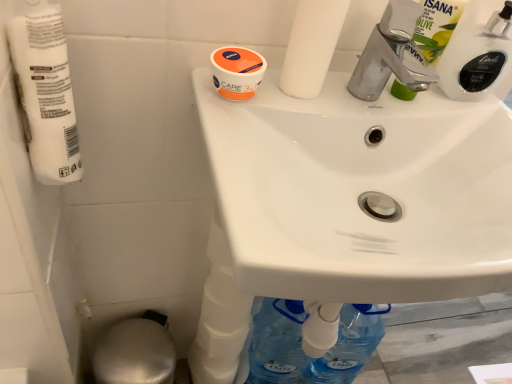
Locate an element on the screen. orange matte jar at upper center is located at coordinates pos(237,72).

Find the location of `green plastic bottle at upper right, positioned as the 1th cleaning product in left-to-right order`. green plastic bottle at upper right, positioned as the 1th cleaning product in left-to-right order is located at coordinates (437, 26).

What do you see at coordinates (46, 93) in the screenshot? This screenshot has height=384, width=512. I see `white matte toilet paper at left, the 1th toilet paper when ordered from left to right` at bounding box center [46, 93].

Where is `orange matte jar at upper center`? orange matte jar at upper center is located at coordinates (237, 72).

From a real-world perspective, which is physically below, silver metallic bidet at lower left or white matte toilet paper at upper center, which ranks as the second toilet paper in left-to-right order?

In real-world perspective, silver metallic bidet at lower left is lower.

Can you tell me how much silver metallic bidet at lower left and white matte toilet paper at upper center, the 1th toilet paper positioned from the right, differ in facing direction?

The facing directions of silver metallic bidet at lower left and white matte toilet paper at upper center, the 1th toilet paper positioned from the right, are 2.53 degrees apart.

Is silver metallic bidet at lower left positioned before white matte toilet paper at upper center, which ranks as the second toilet paper in left-to-right order?

No, silver metallic bidet at lower left is further to the viewer.

Is silver metallic bidet at lower left bigger than white matte toilet paper at upper center, the 1th toilet paper positioned from the right?

Yes.

From the image's perspective, between white glossy bottle at upper right, which is counted as the first cleaning product, starting from the right, and white matte toilet paper at upper center, which ranks as the second toilet paper in left-to-right order, which one is located above?

white matte toilet paper at upper center, which ranks as the second toilet paper in left-to-right order, is shown above in the image.

How far apart are white glossy bottle at upper right, marked as the 2th cleaning product in a left-to-right arrangement, and white matte toilet paper at upper center, which ranks as the second toilet paper in left-to-right order?

white glossy bottle at upper right, marked as the 2th cleaning product in a left-to-right arrangement, is 9.39 inches from white matte toilet paper at upper center, which ranks as the second toilet paper in left-to-right order.

From a real-world perspective, between white glossy bottle at upper right, marked as the 2th cleaning product in a left-to-right arrangement, and white matte toilet paper at upper center, the 1th toilet paper positioned from the right, who is vertically higher?

white matte toilet paper at upper center, the 1th toilet paper positioned from the right, from a real-world perspective.

Is white glossy bottle at upper right, marked as the 2th cleaning product in a left-to-right arrangement, turned away from white matte toilet paper at upper center, which ranks as the second toilet paper in left-to-right order?

white glossy bottle at upper right, marked as the 2th cleaning product in a left-to-right arrangement, is not turned away from white matte toilet paper at upper center, which ranks as the second toilet paper in left-to-right order.

From the picture: Which of these two, white glossy sink at upper center or white glossy bottle at upper right, which is counted as the first cleaning product, starting from the right, is smaller?

With smaller size is white glossy bottle at upper right, which is counted as the first cleaning product, starting from the right.

Looking at this image, is white glossy sink at upper center completely or partially outside of white glossy bottle at upper right, marked as the 2th cleaning product in a left-to-right arrangement?

white glossy sink at upper center lies outside white glossy bottle at upper right, marked as the 2th cleaning product in a left-to-right arrangement,'s area.

Is white glossy sink at upper center taller than white glossy bottle at upper right, which is counted as the first cleaning product, starting from the right?

No, white glossy sink at upper center is not taller than white glossy bottle at upper right, which is counted as the first cleaning product, starting from the right.

Based on the photo, from a real-world perspective, who is located higher, white glossy sink at upper center or white glossy bottle at upper right, marked as the 2th cleaning product in a left-to-right arrangement?

From a 3D spatial view, white glossy bottle at upper right, marked as the 2th cleaning product in a left-to-right arrangement, is above.

Based on the photo, which object is positioned more to the right, silver metallic bidet at lower left or green plastic bottle at upper right, marked as the second cleaning product in a right-to-left arrangement?

From the viewer's perspective, green plastic bottle at upper right, marked as the second cleaning product in a right-to-left arrangement, appears more on the right side.

Between silver metallic bidet at lower left and green plastic bottle at upper right, positioned as the 1th cleaning product in left-to-right order, which one is positioned in front?

green plastic bottle at upper right, positioned as the 1th cleaning product in left-to-right order.

Is silver metallic bidet at lower left not within green plastic bottle at upper right, positioned as the 1th cleaning product in left-to-right order?

Yes, silver metallic bidet at lower left is not within green plastic bottle at upper right, positioned as the 1th cleaning product in left-to-right order.

Considering the sizes of objects silver metallic bidet at lower left and green plastic bottle at upper right, positioned as the 1th cleaning product in left-to-right order, in the image provided, who is thinner, silver metallic bidet at lower left or green plastic bottle at upper right, positioned as the 1th cleaning product in left-to-right order,?

green plastic bottle at upper right, positioned as the 1th cleaning product in left-to-right order.

From a real-world perspective, does white glossy bottle at upper right, which is counted as the first cleaning product, starting from the right, stand above silver metallic bidet at lower left?

Indeed, from a real-world perspective, white glossy bottle at upper right, which is counted as the first cleaning product, starting from the right, stands above silver metallic bidet at lower left.

Is white glossy bottle at upper right, marked as the 2th cleaning product in a left-to-right arrangement, touching silver metallic bidet at lower left?

No, white glossy bottle at upper right, marked as the 2th cleaning product in a left-to-right arrangement, is not touching silver metallic bidet at lower left.

Which of these two, white glossy bottle at upper right, which is counted as the first cleaning product, starting from the right, or silver metallic bidet at lower left, stands shorter?

With less height is white glossy bottle at upper right, which is counted as the first cleaning product, starting from the right.

Does white glossy bottle at upper right, which is counted as the first cleaning product, starting from the right, have a lesser width compared to silver metallic bidet at lower left?

Indeed, white glossy bottle at upper right, which is counted as the first cleaning product, starting from the right, has a lesser width compared to silver metallic bidet at lower left.

In the scene shown: From a real-world perspective, is orange matte jar at upper center positioned under white glossy sink at upper center based on gravity?

Actually, orange matte jar at upper center is physically above white glossy sink at upper center in the real world.

Is orange matte jar at upper center in front of white glossy sink at upper center?

That is False.

Considering the sizes of objects green plastic bottle at upper right, marked as the second cleaning product in a right-to-left arrangement, and white matte toilet paper at upper center, which ranks as the second toilet paper in left-to-right order, in the image provided, who is bigger, green plastic bottle at upper right, marked as the second cleaning product in a right-to-left arrangement, or white matte toilet paper at upper center, which ranks as the second toilet paper in left-to-right order,?

Bigger between the two is white matte toilet paper at upper center, which ranks as the second toilet paper in left-to-right order.

Is white matte toilet paper at upper center, which ranks as the second toilet paper in left-to-right order, inside green plastic bottle at upper right, positioned as the 1th cleaning product in left-to-right order?

That's incorrect, white matte toilet paper at upper center, which ranks as the second toilet paper in left-to-right order, is not inside green plastic bottle at upper right, positioned as the 1th cleaning product in left-to-right order.

From a real-world perspective, is green plastic bottle at upper right, marked as the second cleaning product in a right-to-left arrangement, above or below white matte toilet paper at upper center, which ranks as the second toilet paper in left-to-right order?

In terms of real-world spatial position, green plastic bottle at upper right, marked as the second cleaning product in a right-to-left arrangement, is below white matte toilet paper at upper center, which ranks as the second toilet paper in left-to-right order.

Consider the image. Which object is closer to the camera taking this photo, green plastic bottle at upper right, positioned as the 1th cleaning product in left-to-right order, or white matte toilet paper at upper center, which ranks as the second toilet paper in left-to-right order?

white matte toilet paper at upper center, which ranks as the second toilet paper in left-to-right order, is more forward.

There is a silver metallic bidet at lower left. What are the coordinates of `the 2nd toilet paper above it (from a real-world perspective)` in the screenshot? It's located at (311, 46).

Find the location of `the 2nd cleaning product behind when counting from the white matte toilet paper at upper center, which ranks as the second toilet paper in left-to-right order`. the 2nd cleaning product behind when counting from the white matte toilet paper at upper center, which ranks as the second toilet paper in left-to-right order is located at coordinates (477, 51).

Looking at the image, which one is located closer to silver metallic bidet at lower left, white matte toilet paper at left, the 1th toilet paper when ordered from left to right, or white glossy bottle at upper right, marked as the 2th cleaning product in a left-to-right arrangement?

Among the two, white matte toilet paper at left, the 1th toilet paper when ordered from left to right, is located nearer to silver metallic bidet at lower left.

When comparing their distances from orange matte jar at upper center, does white glossy sink at upper center or white glossy bottle at upper right, which is counted as the first cleaning product, starting from the right, seem closer?

white glossy sink at upper center.

Considering their positions, is orange matte jar at upper center positioned further to white glossy sink at upper center than white glossy bottle at upper right, which is counted as the first cleaning product, starting from the right?

white glossy bottle at upper right, which is counted as the first cleaning product, starting from the right, is positioned further to the anchor white glossy sink at upper center.

When comparing their distances from green plastic bottle at upper right, positioned as the 1th cleaning product in left-to-right order, does white matte toilet paper at upper center, the 1th toilet paper positioned from the right, or white glossy bottle at upper right, marked as the 2th cleaning product in a left-to-right arrangement, seem further?

white matte toilet paper at upper center, the 1th toilet paper positioned from the right.

Based on their spatial positions, is white matte toilet paper at upper center, the 1th toilet paper positioned from the right, or white matte toilet paper at left, the 2th toilet paper in the right-to-left sequence, further from orange matte jar at upper center?

Among the two, white matte toilet paper at left, the 2th toilet paper in the right-to-left sequence, is located further to orange matte jar at upper center.

Estimate the real-world distances between objects in this image. Which object is further from white glossy bottle at upper right, which is counted as the first cleaning product, starting from the right, orange matte jar at upper center or green plastic bottle at upper right, positioned as the 1th cleaning product in left-to-right order?

The object further to white glossy bottle at upper right, which is counted as the first cleaning product, starting from the right, is orange matte jar at upper center.

When comparing their distances from white glossy sink at upper center, does green plastic bottle at upper right, marked as the second cleaning product in a right-to-left arrangement, or orange matte jar at upper center seem closer?

The object closer to white glossy sink at upper center is green plastic bottle at upper right, marked as the second cleaning product in a right-to-left arrangement.

Looking at this image, looking at the image, which one is located further to white matte toilet paper at left, the 1th toilet paper when ordered from left to right, white glossy sink at upper center or white matte toilet paper at upper center, which ranks as the second toilet paper in left-to-right order?

white glossy sink at upper center lies further to white matte toilet paper at left, the 1th toilet paper when ordered from left to right, than the other object.

You are a GUI agent. You are given a task and a screenshot of the screen. Output one action in this format:
    pyautogui.click(x=<x>, y=<y>)
    Task: Click on the sink between white matte toilet paper at left, the 1th toilet paper when ordered from left to right, and green plastic bottle at upper right, marked as the second cleaning product in a right-to-left arrangement, from left to right
    
    Given the screenshot: What is the action you would take?
    pyautogui.click(x=361, y=192)

Locate an element on the screen. The width and height of the screenshot is (512, 384). mouthwash between white matte toilet paper at left, the 2th toilet paper in the right-to-left sequence, and white matte toilet paper at upper center, which ranks as the second toilet paper in left-to-right order, in the horizontal direction is located at coordinates (237, 72).

Find the location of `toilet paper between orange matte jar at upper center and white glossy bottle at upper right, which is counted as the first cleaning product, starting from the right, from left to right`. toilet paper between orange matte jar at upper center and white glossy bottle at upper right, which is counted as the first cleaning product, starting from the right, from left to right is located at coordinates (311, 46).

Where is `toilet paper between white glossy bottle at upper right, marked as the 2th cleaning product in a left-to-right arrangement, and silver metallic bidet at lower left vertically`? Image resolution: width=512 pixels, height=384 pixels. toilet paper between white glossy bottle at upper right, marked as the 2th cleaning product in a left-to-right arrangement, and silver metallic bidet at lower left vertically is located at coordinates (46, 93).